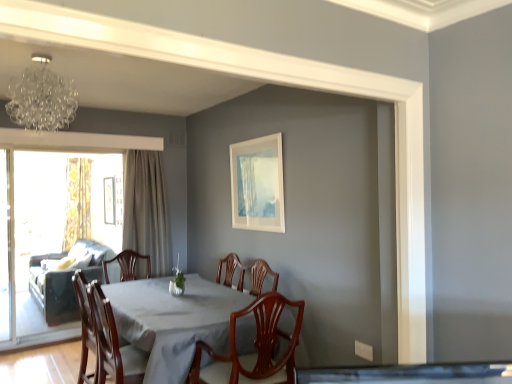
Question: Is crystal glass chandelier at upper left facing away from dark gray fabric couch at left?

Choices:
 (A) no
 (B) yes

Answer: (A)

Question: From a real-world perspective, is crystal glass chandelier at upper left beneath dark gray fabric couch at left?

Choices:
 (A) no
 (B) yes

Answer: (A)

Question: Is crystal glass chandelier at upper left bigger than dark gray fabric couch at left?

Choices:
 (A) no
 (B) yes

Answer: (A)

Question: Is crystal glass chandelier at upper left located outside dark gray fabric couch at left?

Choices:
 (A) no
 (B) yes

Answer: (B)

Question: Is the position of crystal glass chandelier at upper left less distant than that of dark gray fabric couch at left?

Choices:
 (A) yes
 (B) no

Answer: (A)

Question: Are crystal glass chandelier at upper left and dark gray fabric couch at left beside each other?

Choices:
 (A) no
 (B) yes

Answer: (A)

Question: Is white matte picture frame at upper center, arranged as the 2th picture frame when viewed from the left, positioned in front of clear glass screen door at left, the 2th screen door viewed from the right?

Choices:
 (A) yes
 (B) no

Answer: (A)

Question: Is clear glass screen door at left, the 2th screen door viewed from the right, completely or partially inside white matte picture frame at upper center, which is the first picture frame in front-to-back order?

Choices:
 (A) no
 (B) yes

Answer: (A)

Question: Can you confirm if white matte picture frame at upper center, the 1th picture frame in the right-to-left sequence, is thinner than clear glass screen door at left, which ranks as the first screen door in left-to-right order?

Choices:
 (A) no
 (B) yes

Answer: (B)

Question: Does white matte picture frame at upper center, the 1th picture frame in the right-to-left sequence, touch clear glass screen door at left, the 2th screen door viewed from the right?

Choices:
 (A) yes
 (B) no

Answer: (B)

Question: Is there a large distance between white matte picture frame at upper center, the 1th picture frame in the right-to-left sequence, and clear glass screen door at left, which ranks as the first screen door in left-to-right order?

Choices:
 (A) yes
 (B) no

Answer: (A)

Question: Can we say white matte picture frame at upper center, the 1th picture frame in the right-to-left sequence, lies outside clear glass screen door at left, the 2th screen door viewed from the right?

Choices:
 (A) yes
 (B) no

Answer: (A)

Question: Considering the relative sizes of clear glass screen door at left, which ranks as the first screen door in left-to-right order, and crystal glass chandelier at upper left in the image provided, is clear glass screen door at left, which ranks as the first screen door in left-to-right order, thinner than crystal glass chandelier at upper left?

Choices:
 (A) no
 (B) yes

Answer: (B)